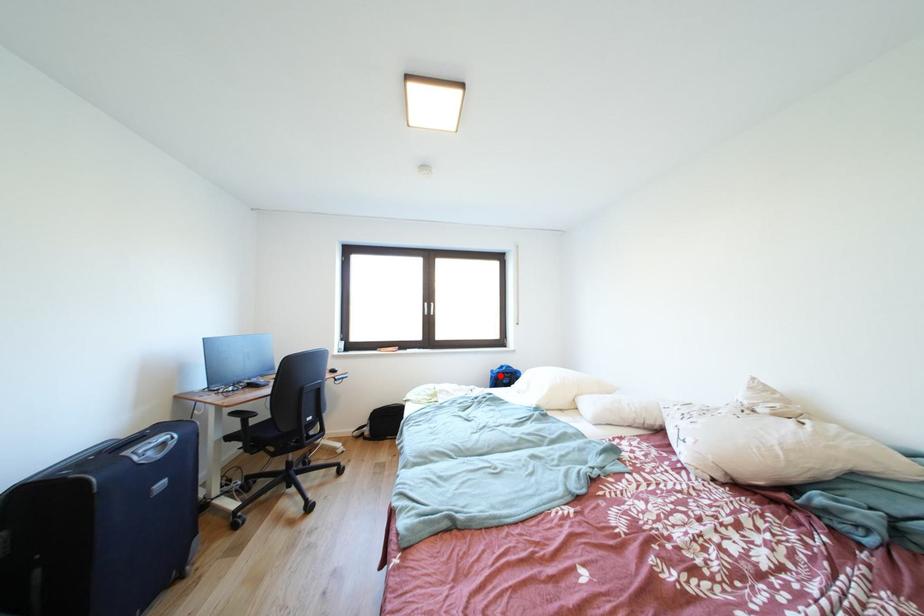
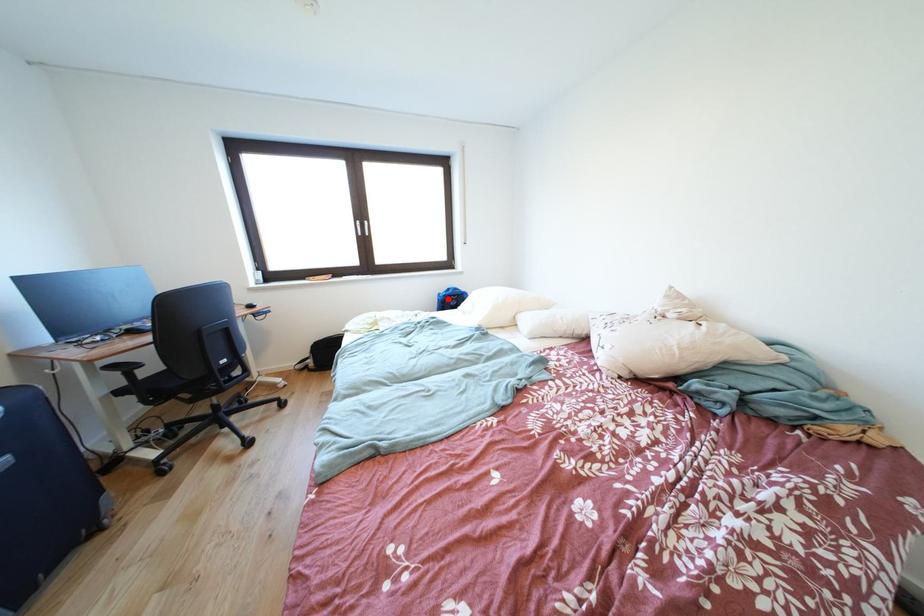
I am providing you with two images of the same scene from different viewpoints. A red point is marked on the first image and another point is marked on the second image. Does the point marked in image1 correspond to the same location as the one in image2?

Yes